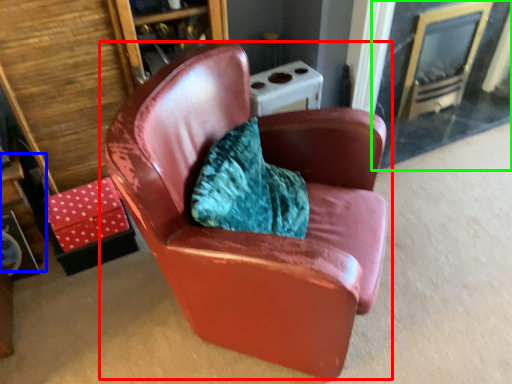
Question: Based on their relative distances, which object is farther from chair (highlighted by a red box)? Choose from table (highlighted by a blue box) and glass door (highlighted by a green box).

Choices:
 (A) table
 (B) glass door

Answer: (B)